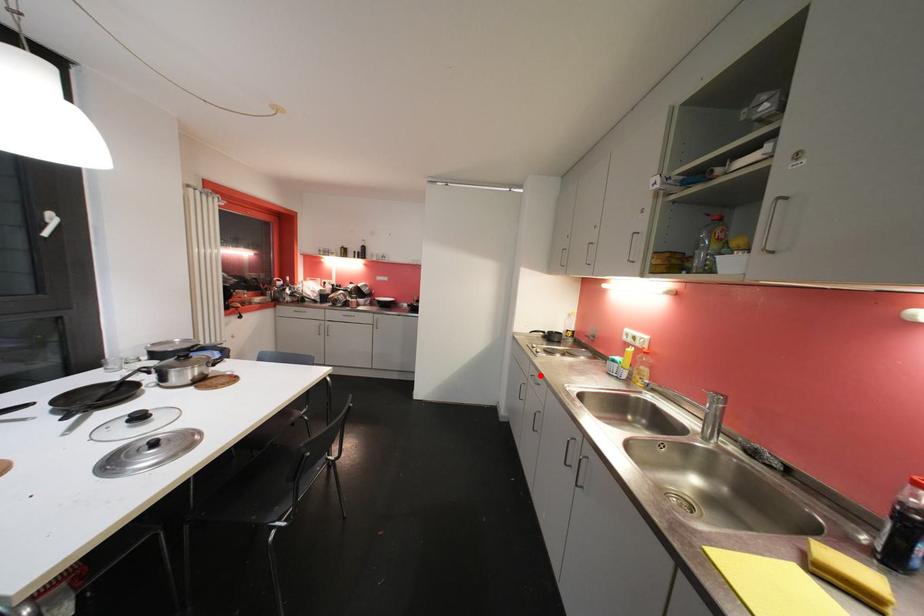
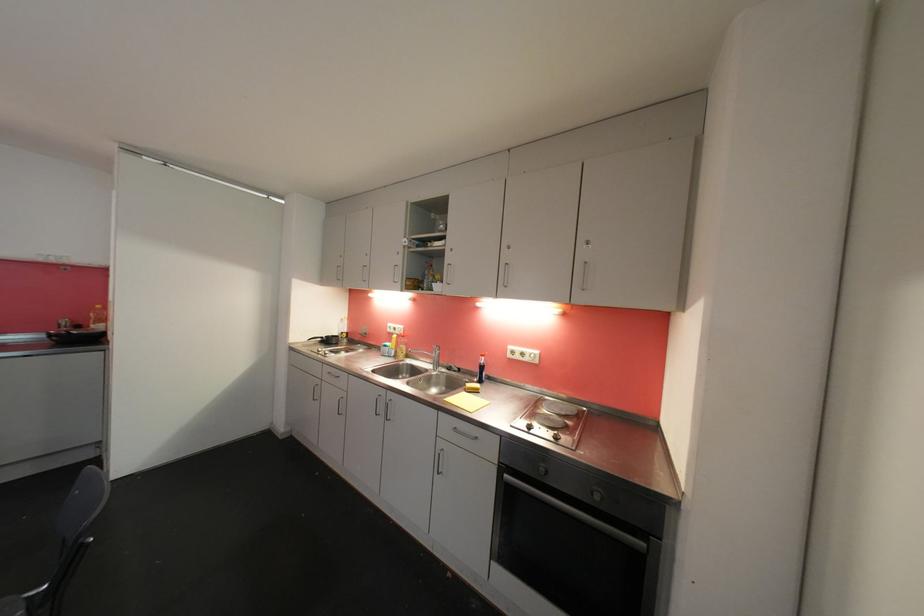
Find the pixel in the second image that matches the highlighted location in the first image.

(336, 371)